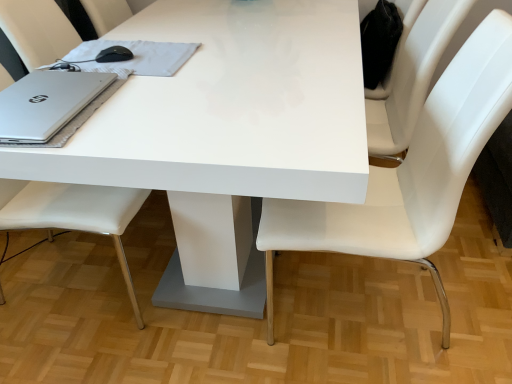
What is the approximate width of satin silver notebook at upper left?

The width of satin silver notebook at upper left is 30.68 centimeters.

Describe the element at coordinates (410, 173) in the screenshot. This screenshot has width=512, height=384. I see `white leather chair at center, which is the second chair in left-to-right order` at that location.

Describe the element at coordinates (47, 103) in the screenshot. This screenshot has height=384, width=512. I see `silver metallic laptop at left` at that location.

At what (x,y) coordinates should I click in order to perform the action: click on white glossy table at center. Please return your answer as a coordinate pair (x, y). Looking at the image, I should click on (226, 118).

From a real-world perspective, who is located higher, white leather chair at center, which is the second chair in left-to-right order, or silver metallic laptop at left?

In real-world perspective, silver metallic laptop at left is above.

Is white leather chair at center, which is the second chair in left-to-right order, turned away from silver metallic laptop at left?

No, silver metallic laptop at left is not at the back of white leather chair at center, which is the second chair in left-to-right order.

At what (x,y) coordinates should I click in order to perform the action: click on chair on the right of silver metallic laptop at left. Please return your answer as a coordinate pair (x, y). The height and width of the screenshot is (384, 512). Looking at the image, I should click on (410, 173).

Could you measure the distance between white leather chair at center, positioned as the first chair in right-to-left order, and silver metallic laptop at left?

white leather chair at center, positioned as the first chair in right-to-left order, is 73.71 centimeters away from silver metallic laptop at left.

Can you see satin silver notebook at upper left touching silver metallic laptop at left?

No, satin silver notebook at upper left is not with silver metallic laptop at left.

Between satin silver notebook at upper left and silver metallic laptop at left, which one has smaller width?

Thinner between the two is satin silver notebook at upper left.

From the image's perspective, is satin silver notebook at upper left located beneath silver metallic laptop at left?

No, from the image's perspective, satin silver notebook at upper left is not beneath silver metallic laptop at left.

Is white glossy table at center thinner than satin silver notebook at upper left?

No, white glossy table at center is not thinner than satin silver notebook at upper left.

Consider the image. Considering the relative sizes of white glossy table at center and satin silver notebook at upper left in the image provided, is white glossy table at center smaller than satin silver notebook at upper left?

Actually, white glossy table at center might be larger than satin silver notebook at upper left.

Does white glossy table at center lie behind satin silver notebook at upper left?

No, white glossy table at center is closer to the viewer.

The height and width of the screenshot is (384, 512). I want to click on table in front of the satin silver notebook at upper left, so click(226, 118).

From a real-world perspective, is satin silver notebook at upper left positioned under white leather chair at center, which is the second chair in left-to-right order, based on gravity?

No.

Considering the relative sizes of satin silver notebook at upper left and white leather chair at center, which is the second chair in left-to-right order, in the image provided, is satin silver notebook at upper left shorter than white leather chair at center, which is the second chair in left-to-right order,?

Yes, satin silver notebook at upper left is shorter than white leather chair at center, which is the second chair in left-to-right order.

Which object is further away from the camera, satin silver notebook at upper left or white leather chair at center, which is the second chair in left-to-right order?

satin silver notebook at upper left is further from the camera.

Are satin silver notebook at upper left and white glossy table at center located far from each other?

satin silver notebook at upper left is near white glossy table at center, not far away.

Considering the sizes of objects satin silver notebook at upper left and white glossy table at center in the image provided, who is wider, satin silver notebook at upper left or white glossy table at center?

white glossy table at center is wider.

Considering the sizes of objects satin silver notebook at upper left and white glossy table at center in the image provided, who is smaller, satin silver notebook at upper left or white glossy table at center?

satin silver notebook at upper left is smaller.

Would you say satin silver notebook at upper left contains white glossy table at center?

No.

Is white leather chair at left, which appears as the first chair when viewed from the left, not within satin silver notebook at upper left?

white leather chair at left, which appears as the first chair when viewed from the left, is positioned outside satin silver notebook at upper left.

Between white leather chair at left, which ranks as the second chair in right-to-left order, and satin silver notebook at upper left, which one is positioned behind?

satin silver notebook at upper left.

Is white leather chair at left, which appears as the first chair when viewed from the left, touching satin silver notebook at upper left?

They are not placed beside each other.

Which of these two, silver metallic laptop at left or satin silver notebook at upper left, stands taller?

Standing taller between the two is silver metallic laptop at left.

Would you say silver metallic laptop at left is a long distance from satin silver notebook at upper left?

Actually, silver metallic laptop at left and satin silver notebook at upper left are a little close together.

This screenshot has height=384, width=512. Identify the location of notebook that is on the right side of silver metallic laptop at left. (137, 56).

From the image's perspective, is silver metallic laptop at left above or below satin silver notebook at upper left?

From the image's perspective, silver metallic laptop at left appears below satin silver notebook at upper left.

Where is `chair in front of the silver metallic laptop at left`? Image resolution: width=512 pixels, height=384 pixels. chair in front of the silver metallic laptop at left is located at coordinates (410, 173).

This screenshot has height=384, width=512. What are the coordinates of `laptop above the satin silver notebook at upper left (from a real-world perspective)` in the screenshot? It's located at (47, 103).

When comparing their distances from white leather chair at left, which ranks as the second chair in right-to-left order, does white glossy table at center or white leather chair at center, which is the second chair in left-to-right order, seem closer?

white glossy table at center lies closer to white leather chair at left, which ranks as the second chair in right-to-left order, than the other object.

Estimate the real-world distances between objects in this image. Which object is further from white glossy table at center, silver metallic laptop at left or white leather chair at left, which appears as the first chair when viewed from the left?

white leather chair at left, which appears as the first chair when viewed from the left, is positioned further to the anchor white glossy table at center.

Which object lies further to the anchor point white glossy table at center, white leather chair at center, positioned as the first chair in right-to-left order, or satin silver notebook at upper left?

white leather chair at center, positioned as the first chair in right-to-left order, is positioned further to the anchor white glossy table at center.

Estimate the real-world distances between objects in this image. Which object is further from white leather chair at center, which is the second chair in left-to-right order, satin silver notebook at upper left or white glossy table at center?

satin silver notebook at upper left is positioned further to the anchor white leather chair at center, which is the second chair in left-to-right order.

Estimate the real-world distances between objects in this image. Which object is further from white leather chair at left, which appears as the first chair when viewed from the left, silver metallic laptop at left or white leather chair at center, which is the second chair in left-to-right order?

Among the two, white leather chair at center, which is the second chair in left-to-right order, is located further to white leather chair at left, which appears as the first chair when viewed from the left.

Estimate the real-world distances between objects in this image. Which object is further from white leather chair at center, positioned as the first chair in right-to-left order, white leather chair at left, which ranks as the second chair in right-to-left order, or white glossy table at center?

white leather chair at left, which ranks as the second chair in right-to-left order.

Estimate the real-world distances between objects in this image. Which object is further from silver metallic laptop at left, white leather chair at left, which ranks as the second chair in right-to-left order, or white glossy table at center?

Among the two, white glossy table at center is located further to silver metallic laptop at left.

Which object lies further to the anchor point white leather chair at left, which appears as the first chair when viewed from the left, satin silver notebook at upper left or white glossy table at center?

white glossy table at center.

At what (x,y) coordinates should I click in order to perform the action: click on table between white leather chair at left, which appears as the first chair when viewed from the left, and white leather chair at center, which is the second chair in left-to-right order. Please return your answer as a coordinate pair (x, y). This screenshot has height=384, width=512. Looking at the image, I should click on (226, 118).

Locate an element on the screen. The width and height of the screenshot is (512, 384). notebook between silver metallic laptop at left and white leather chair at center, positioned as the first chair in right-to-left order, in the horizontal direction is located at coordinates (137, 56).

Locate an element on the screen. notebook located between white leather chair at left, which appears as the first chair when viewed from the left, and white leather chair at center, positioned as the first chair in right-to-left order, in the left-right direction is located at coordinates (137, 56).

Where is `table between silver metallic laptop at left and white leather chair at center, positioned as the first chair in right-to-left order, from left to right`? The height and width of the screenshot is (384, 512). table between silver metallic laptop at left and white leather chair at center, positioned as the first chair in right-to-left order, from left to right is located at coordinates [226, 118].